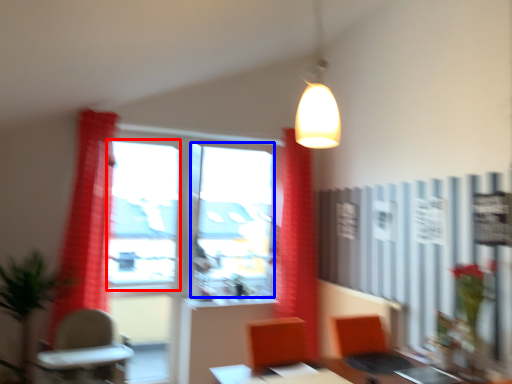
Question: Which point is closer to the camera, window screen (highlighted by a red box) or window screen (highlighted by a blue box)?

Choices:
 (A) window screen
 (B) window screen

Answer: (A)